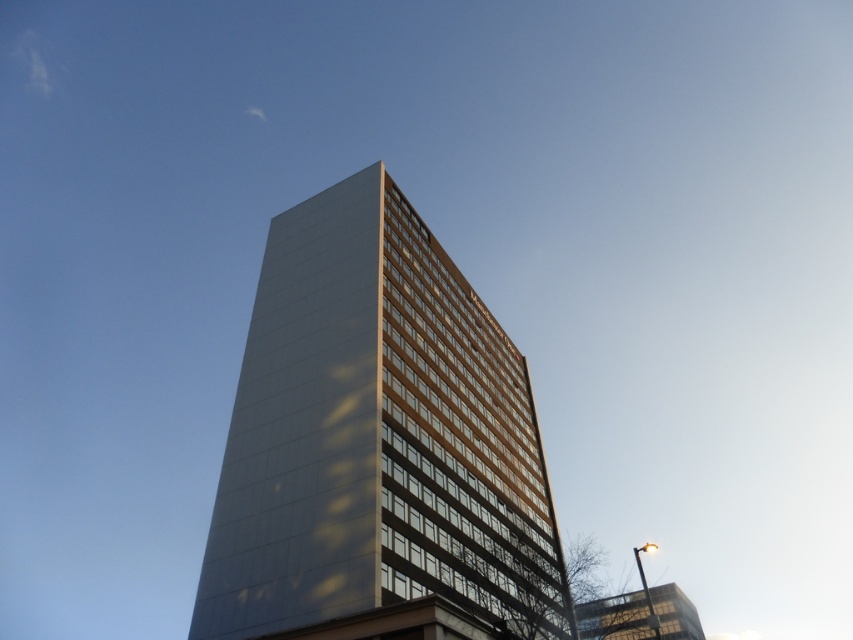
Question: Is matte glass tower at center thinner than clear glass building at lower right?

Choices:
 (A) no
 (B) yes

Answer: (B)

Question: Which point is closer to the camera?

Choices:
 (A) matte glass tower at center
 (B) clear glass building at lower right

Answer: (B)

Question: Is matte glass tower at center wider than clear glass building at lower right?

Choices:
 (A) yes
 (B) no

Answer: (B)

Question: Among these objects, which one is farthest from the camera?

Choices:
 (A) clear glass building at lower right
 (B) matte glass tower at center

Answer: (B)

Question: Does matte glass tower at center have a smaller size compared to clear glass building at lower right?

Choices:
 (A) yes
 (B) no

Answer: (A)

Question: Which of the following is the closest to the observer?

Choices:
 (A) clear glass building at lower right
 (B) matte glass tower at center

Answer: (A)